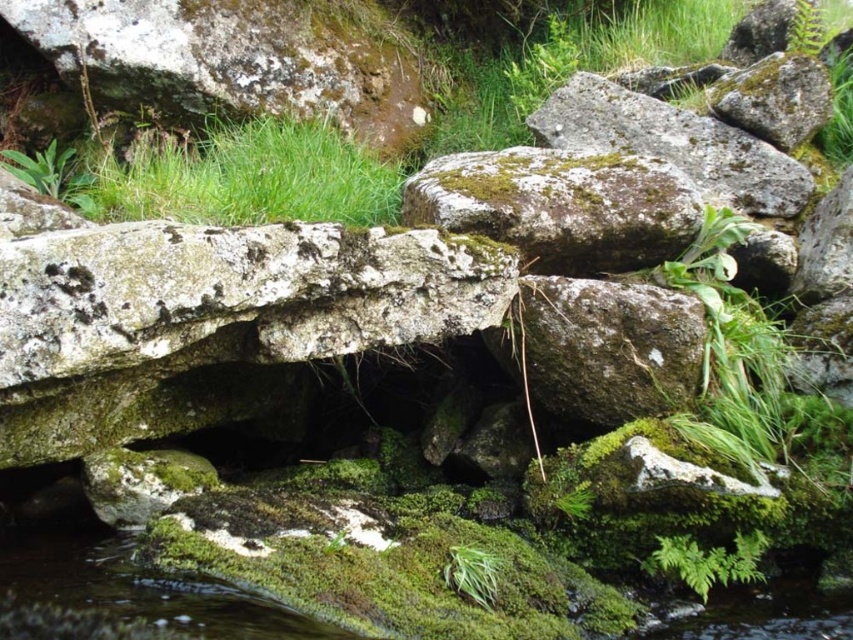
Question: Estimate the real-world distances between objects in this image. Which object is closer to the green leafy fern at lower right?

Choices:
 (A) mossy stone at upper left
 (B) green mossy grass at upper center

Answer: (B)

Question: Can you confirm if green mossy grass at upper center is positioned to the right of green mossy rock at center-right?

Choices:
 (A) yes
 (B) no

Answer: (B)

Question: Estimate the real-world distances between objects in this image. Which object is closer to the green mossy grass at upper center?

Choices:
 (A) mossy stone at upper left
 (B) green mossy rock at center

Answer: (A)

Question: Considering the relative positions of green mossy grass at upper center and green leafy fern at lower right in the image provided, where is green mossy grass at upper center located with respect to green leafy fern at lower right?

Choices:
 (A) left
 (B) right

Answer: (A)

Question: Among these objects, which one is nearest to the camera?

Choices:
 (A) green mossy grass at upper center
 (B) green mossy rock at center-right

Answer: (A)

Question: Can you confirm if green mossy rock at center is positioned above green leafy fern at lower right?

Choices:
 (A) no
 (B) yes

Answer: (B)